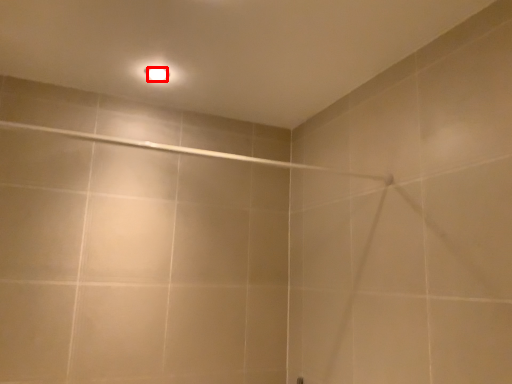
Question: From the image, what is the correct spatial relationship of light bulb (annotated by the red box) in relation to shower?

Choices:
 (A) left
 (B) right

Answer: (A)